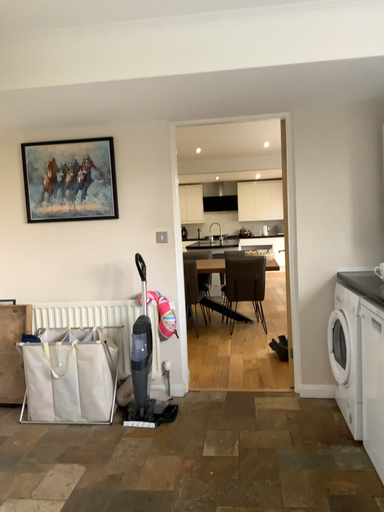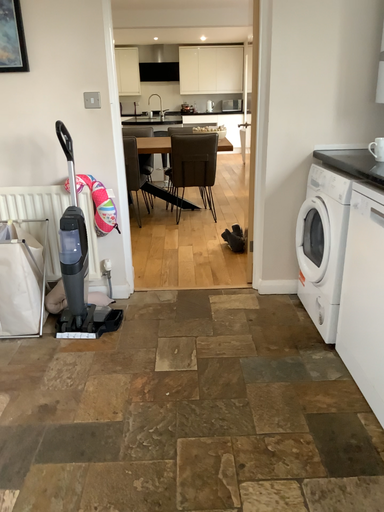
Question: How did the camera likely rotate when shooting the video?

Choices:
 (A) rotated left
 (B) rotated right

Answer: (B)